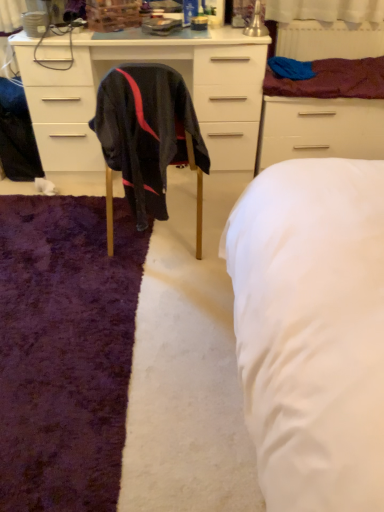
The image size is (384, 512). Find the location of `free spot above white painted radiator at upper right (from a real-world perspective)`. free spot above white painted radiator at upper right (from a real-world perspective) is located at coordinates (331, 19).